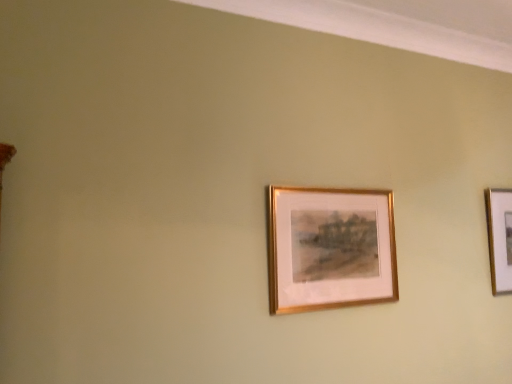
Question: Is gold metallic picture frame at right, the second picture frame positioned from the left, located outside gold metallic picture frame at center, placed as the first picture frame when sorted from left to right?

Choices:
 (A) no
 (B) yes

Answer: (B)

Question: Can you confirm if gold metallic picture frame at right, which is the second picture frame in front-to-back order, is wider than gold metallic picture frame at center, placed as the first picture frame when sorted from left to right?

Choices:
 (A) yes
 (B) no

Answer: (A)

Question: Would you say gold metallic picture frame at center, the second picture frame in the right-to-left sequence, is part of gold metallic picture frame at right, which is the second picture frame in front-to-back order,'s contents?

Choices:
 (A) no
 (B) yes

Answer: (A)

Question: Is gold metallic picture frame at right, which appears as the first picture frame when viewed from the back, facing towards gold metallic picture frame at center, placed as the first picture frame when sorted from left to right?

Choices:
 (A) yes
 (B) no

Answer: (B)

Question: Can you confirm if gold metallic picture frame at right, the second picture frame positioned from the left, is taller than gold metallic picture frame at center, the second picture frame in the right-to-left sequence?

Choices:
 (A) yes
 (B) no

Answer: (A)

Question: From the image's perspective, is gold metallic picture frame at right, which is the second picture frame in front-to-back order, located above gold metallic picture frame at center, the second picture frame in the right-to-left sequence?

Choices:
 (A) no
 (B) yes

Answer: (A)

Question: Can you see gold metallic picture frame at center, placed as the first picture frame when sorted from left to right, touching gold metallic picture frame at right, which appears as the first picture frame when viewed from the back?

Choices:
 (A) yes
 (B) no

Answer: (B)

Question: Can you confirm if gold metallic picture frame at center, placed as the first picture frame when sorted from left to right, is positioned to the left of gold metallic picture frame at right, which is the second picture frame in front-to-back order?

Choices:
 (A) yes
 (B) no

Answer: (A)

Question: Does gold metallic picture frame at center, which is counted as the first picture frame, starting from the front, have a greater width compared to gold metallic picture frame at right, which appears as the first picture frame when viewed from the back?

Choices:
 (A) yes
 (B) no

Answer: (B)

Question: Is gold metallic picture frame at center, which appears as the second picture frame when viewed from the back, positioned far away from gold metallic picture frame at right, the second picture frame positioned from the left?

Choices:
 (A) no
 (B) yes

Answer: (A)

Question: From a real-world perspective, does gold metallic picture frame at center, which is counted as the first picture frame, starting from the front, stand above gold metallic picture frame at right, which appears as the first picture frame when viewed from the back?

Choices:
 (A) no
 (B) yes

Answer: (A)

Question: Is gold metallic picture frame at center, which appears as the second picture frame when viewed from the back, to the right of gold metallic picture frame at right, the second picture frame positioned from the left, from the viewer's perspective?

Choices:
 (A) yes
 (B) no

Answer: (B)

Question: Is point (380, 291) positioned closer to the camera than point (503, 210)?

Choices:
 (A) closer
 (B) farther

Answer: (A)